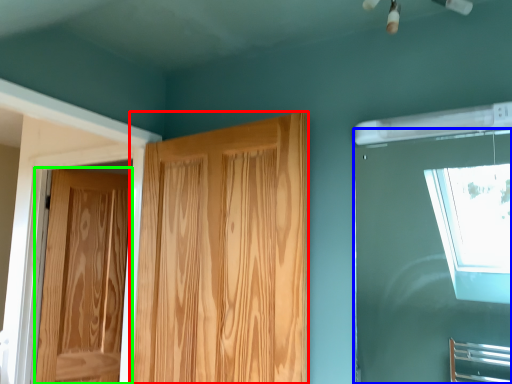
Question: Which object is positioned closest to door (highlighted by a red box)? Select from window (highlighted by a blue box) and door (highlighted by a green box).

Choices:
 (A) window
 (B) door

Answer: (B)